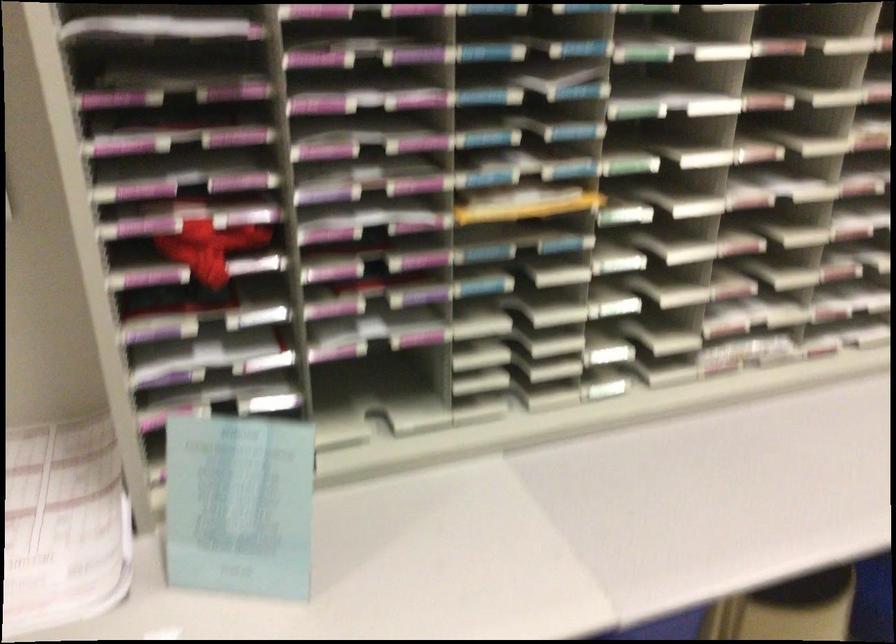
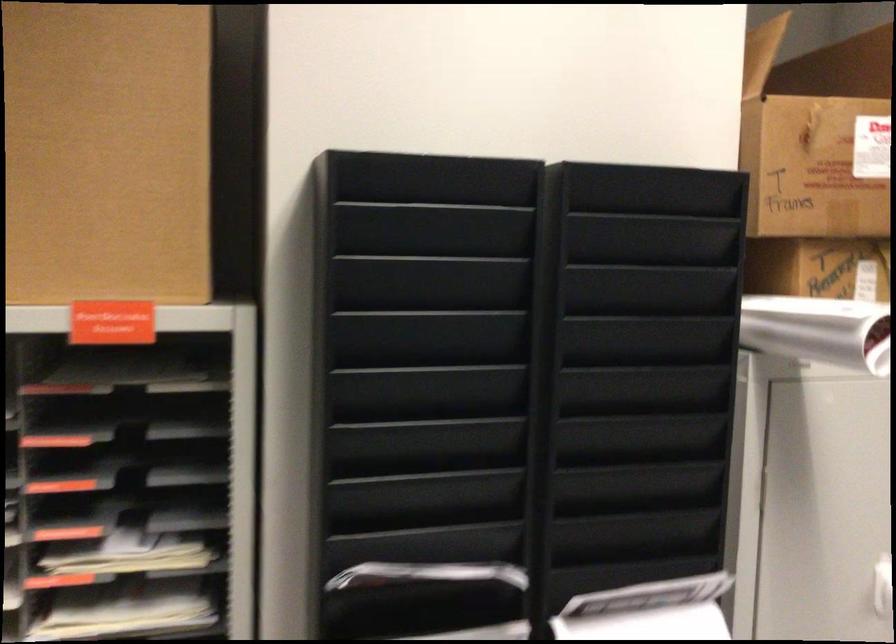
Question: What movement of the cameraman would produce the second image?

Choices:
 (A) Left
 (B) Right
 (C) Forward
 (D) Backward

Answer: (B)